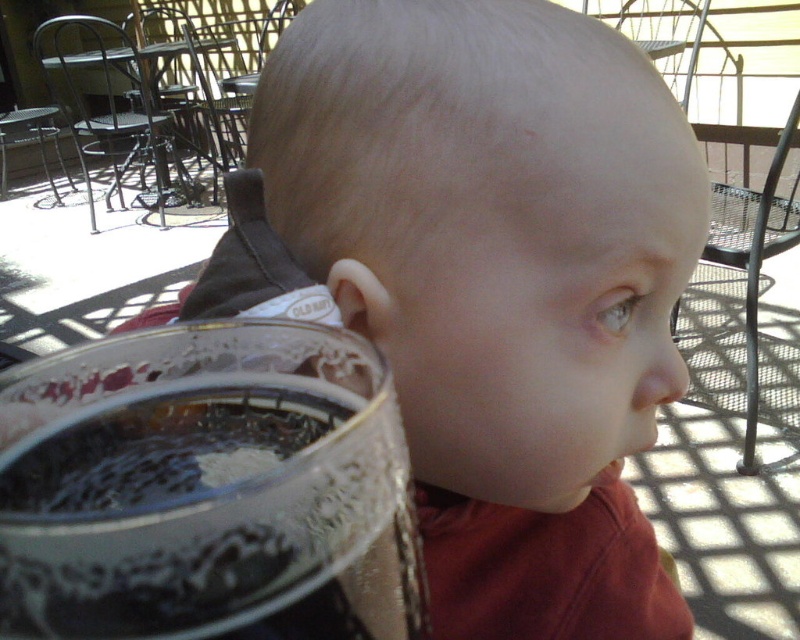
You are a photographer trying to capture a candid shot of the baby in the scene. You notice two points marked in the image. The first point is at coordinates point (322, 202) and the second is at point (356, 369). Which point is closer to the baby?

Point (356, 369) is closer to the baby because it is in front of point (322, 202), which is behind it.